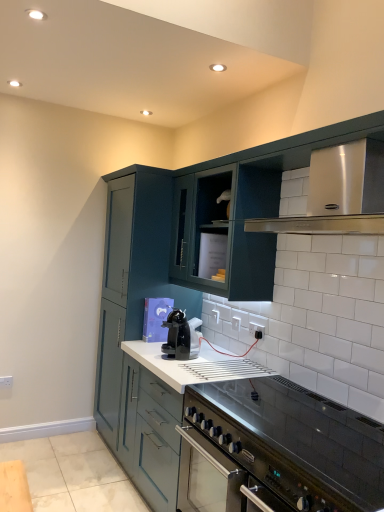
Question: Is white glossy countertop at center spatially inside satin silver vent at upper right, or outside of it?

Choices:
 (A) inside
 (B) outside

Answer: (B)

Question: Is white glossy countertop at center taller or shorter than satin silver vent at upper right?

Choices:
 (A) short
 (B) tall

Answer: (B)

Question: Which object is the farthest from the teal matte cabinet at center, marked as the first cabinetry in a back-to-front arrangement?

Choices:
 (A) teal matte cabinet at center, which is counted as the first cabinetry, starting from the front
 (B) white glossy countertop at center
 (C) satin silver vent at upper right
 (D) black glossy coffee machine at center
 (E) white plastic electric outlet at center, the 1th electric outlet viewed from the top

Answer: (C)

Question: Based on their relative distances, which object is nearer to the teal matte cabinet at center, marked as the first cabinetry in a back-to-front arrangement?

Choices:
 (A) black glossy coffee machine at center
 (B) white plastic electric outlet at lower left, which appears as the second electric outlet when viewed from the right
 (C) stainless steel oven at lower right
 (D) white plastic electric outlet at center, acting as the 2th electric outlet starting from the bottom
 (E) teal matte cabinet at center, the second cabinetry in the back-to-front sequence

Answer: (E)